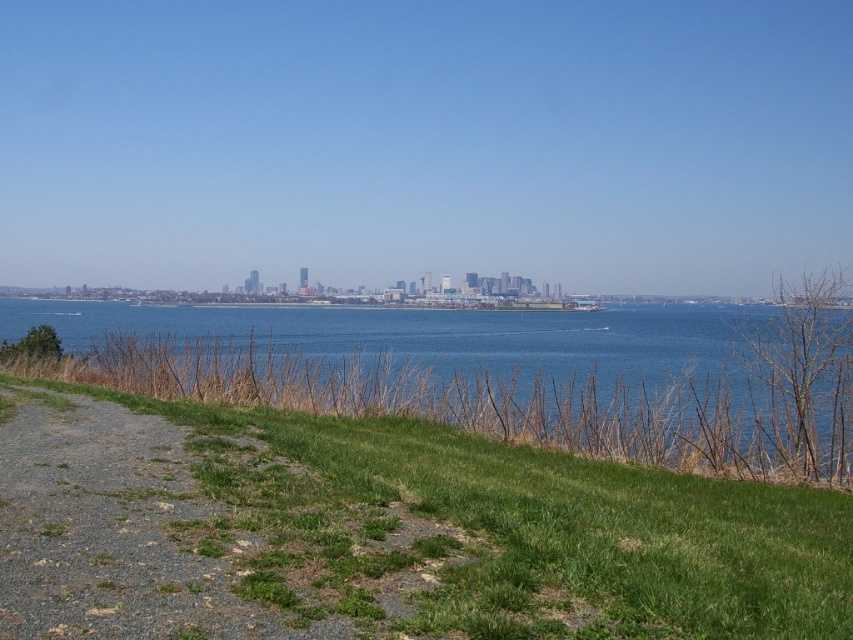
You are planning to set up a picnic blanket on the green grassy slope at lower left. Considering the size of the slope compared to the blue water at center, will there be enough space for a picnic blanket that is 2 meters by 2 meters?

The green grassy slope at lower left has a smaller size compared to the blue water at center, so it may not have enough space for a 2 meter by 2 meter picnic blanket.